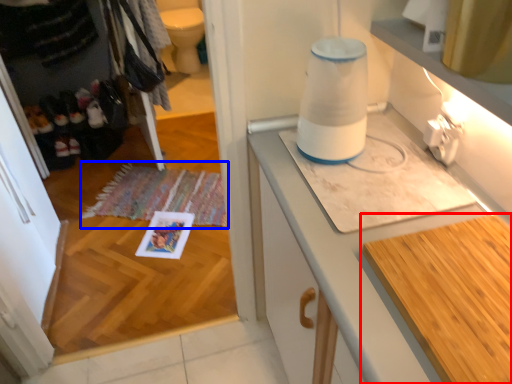
Question: Among these objects, which one is farthest to the camera, countertop (highlighted by a red box) or mat (highlighted by a blue box)?

Choices:
 (A) countertop
 (B) mat

Answer: (B)